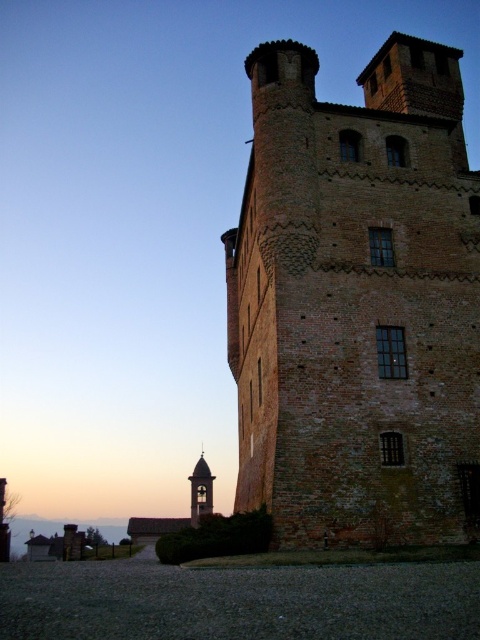
You are standing at the base of the historic brick tower and want to take a photo of the point marked at coordinates [463,486]. If your camera has a maximum zoom range of 100 feet, will you be able to capture that point clearly?

The point at coordinates [463,486] is 133.23 feet away from the camera. Since the camera can only zoom up to 100 feet, it will not be able to capture the point clearly.

You are standing in front of the historic brick structure and want to walk towards the brown brick tower at center right. Which direction should you move relative to the smooth stone bell tower at lower center?

The brown brick tower at center right is positioned on the right side of the smooth stone bell tower at lower center, so you should move to the right relative to the smooth stone bell tower at lower center to reach it.

You are an architect examining the historic brick structure. You notice the brown brick tower at center right and the smooth stone bell tower at lower center. Which of these two structures is situated higher in the image?

The brown brick tower at center right is positioned over the smooth stone bell tower at lower center, so it is situated higher in the image.